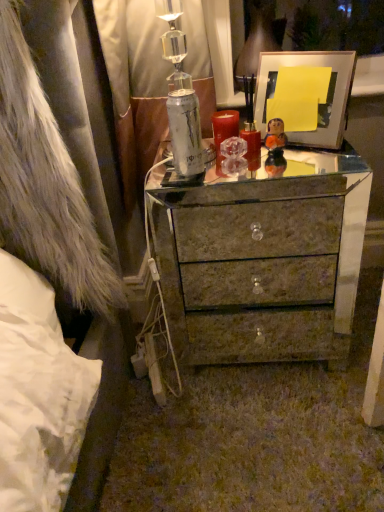
Find the location of a particular element. marble-like drawer at center is located at coordinates (258, 230).

Find the location of a particular element. Image resolution: width=384 pixels, height=512 pixels. shiny metallic chest of drawers at center is located at coordinates (263, 258).

Does matte white picture frame at upper right have a smaller size compared to shiny metallic chest of drawers at center?

Yes.

This screenshot has height=512, width=384. I want to click on the chest of drawers beneath the matte white picture frame at upper right (from a real-world perspective), so click(x=263, y=258).

From the image's perspective, is matte white picture frame at upper right on top of shiny metallic chest of drawers at center?

Yes, from the image's perspective, matte white picture frame at upper right is above shiny metallic chest of drawers at center.

Which object is further away from the camera, matte white picture frame at upper right or shiny metallic chest of drawers at center?

matte white picture frame at upper right.

Is marble-like drawer at center at the back of fuzzy white fur coat at left?

No, fuzzy white fur coat at left's orientation is not away from marble-like drawer at center.

Would you say fuzzy white fur coat at left is a long distance from marble-like drawer at center?

fuzzy white fur coat at left is actually quite close to marble-like drawer at center.

Could marble-like drawer at center be considered to be inside fuzzy white fur coat at left?

No, marble-like drawer at center is not a part of fuzzy white fur coat at left.

How many degrees apart are the facing directions of fuzzy white fur coat at left and marble-like drawer at center?

0.279 degrees.

Which of these two, marble-like drawer at center or matte white picture frame at upper right, is smaller?

Smaller between the two is matte white picture frame at upper right.

How far apart are marble-like drawer at center and matte white picture frame at upper right?

marble-like drawer at center and matte white picture frame at upper right are 30.49 inches apart.

Is marble-like drawer at center looking in the opposite direction of matte white picture frame at upper right?

marble-like drawer at center does not have its back to matte white picture frame at upper right.

Is matte white picture frame at upper right wider or thinner than marble-like drawer at center?

In the image, matte white picture frame at upper right appears to be wider than marble-like drawer at center.

Considering the sizes of objects matte white picture frame at upper right and marble-like drawer at center in the image provided, who is shorter, matte white picture frame at upper right or marble-like drawer at center?

Standing shorter between the two is marble-like drawer at center.

Is matte white picture frame at upper right turned away from marble-like drawer at center?

No, matte white picture frame at upper right is not facing the opposite direction of marble-like drawer at center.

Can you tell me how much matte white picture frame at upper right and marble-like drawer at center differ in facing direction?

matte white picture frame at upper right and marble-like drawer at center are facing 33.1 degrees away from each other.

Is fuzzy white fur coat at left shorter than matte white picture frame at upper right?

No, fuzzy white fur coat at left is not shorter than matte white picture frame at upper right.

Which point is more forward, (82, 211) or (325, 62)?

Point (82, 211)

Between fuzzy white fur coat at left and matte white picture frame at upper right, which one is positioned behind?

matte white picture frame at upper right is further away from the camera.

Who is shorter, shiny metallic chest of drawers at center or fuzzy white fur coat at left?

shiny metallic chest of drawers at center is shorter.

Can you confirm if shiny metallic chest of drawers at center is wider than fuzzy white fur coat at left?

No, shiny metallic chest of drawers at center is not wider than fuzzy white fur coat at left.

Considering the positions of objects shiny metallic chest of drawers at center and fuzzy white fur coat at left in the image provided, who is more to the right, shiny metallic chest of drawers at center or fuzzy white fur coat at left?

shiny metallic chest of drawers at center is more to the right.

Is shiny metallic chest of drawers at center inside the boundaries of matte white picture frame at upper right, or outside?

shiny metallic chest of drawers at center is outside matte white picture frame at upper right.

Between shiny metallic chest of drawers at center and matte white picture frame at upper right, which one has less height?

With less height is matte white picture frame at upper right.

Can you tell me how much shiny metallic chest of drawers at center and matte white picture frame at upper right differ in facing direction?

There is a 33.9-degree angle between the facing directions of shiny metallic chest of drawers at center and matte white picture frame at upper right.

Who is bigger, shiny metallic chest of drawers at center or matte white picture frame at upper right?

Bigger between the two is shiny metallic chest of drawers at center.

Locate an element on the screen. the chest of drawers that appears below the matte white picture frame at upper right (from the image's perspective) is located at coordinates (263, 258).

This screenshot has width=384, height=512. I want to click on drawer that is behind the fuzzy white fur coat at left, so click(258, 230).

Based on their spatial positions, is matte white picture frame at upper right or marble-like drawer at center further from fuzzy white fur coat at left?

Based on the image, marble-like drawer at center appears to be further to fuzzy white fur coat at left.

Considering their positions, is matte white picture frame at upper right positioned closer to shiny metallic chest of drawers at center than fuzzy white fur coat at left?

Among the two, matte white picture frame at upper right is located nearer to shiny metallic chest of drawers at center.

Consider the image. Based on their spatial positions, is shiny metallic chest of drawers at center or matte white picture frame at upper right closer to marble-like drawer at center?

Among the two, shiny metallic chest of drawers at center is located nearer to marble-like drawer at center.

Which object lies further to the anchor point fuzzy white fur coat at left, matte white picture frame at upper right or shiny metallic chest of drawers at center?

matte white picture frame at upper right is further to fuzzy white fur coat at left.

From the image, which object appears to be nearer to shiny metallic chest of drawers at center, fuzzy white fur coat at left or marble-like drawer at center?

marble-like drawer at center.

In the scene shown: Estimate the real-world distances between objects in this image. Which object is further from matte white picture frame at upper right, shiny metallic chest of drawers at center or marble-like drawer at center?

marble-like drawer at center lies further to matte white picture frame at upper right than the other object.

When comparing their distances from matte white picture frame at upper right, does marble-like drawer at center or fuzzy white fur coat at left seem further?

marble-like drawer at center is positioned further to the anchor matte white picture frame at upper right.

Which object lies further to the anchor point marble-like drawer at center, fuzzy white fur coat at left or matte white picture frame at upper right?

fuzzy white fur coat at left lies further to marble-like drawer at center than the other object.

Image resolution: width=384 pixels, height=512 pixels. What are the coordinates of `chest of drawers between fuzzy white fur coat at left and marble-like drawer at center from front to back` in the screenshot? It's located at (263, 258).

Find the location of a particular element. The width and height of the screenshot is (384, 512). the chest of drawers situated between fuzzy white fur coat at left and matte white picture frame at upper right from left to right is located at coordinates (263, 258).

Identify the location of picture frame between fuzzy white fur coat at left and marble-like drawer at center from front to back. (312, 97).

Where is `picture frame located between shiny metallic chest of drawers at center and marble-like drawer at center in the depth direction`? This screenshot has width=384, height=512. picture frame located between shiny metallic chest of drawers at center and marble-like drawer at center in the depth direction is located at coordinates (312, 97).